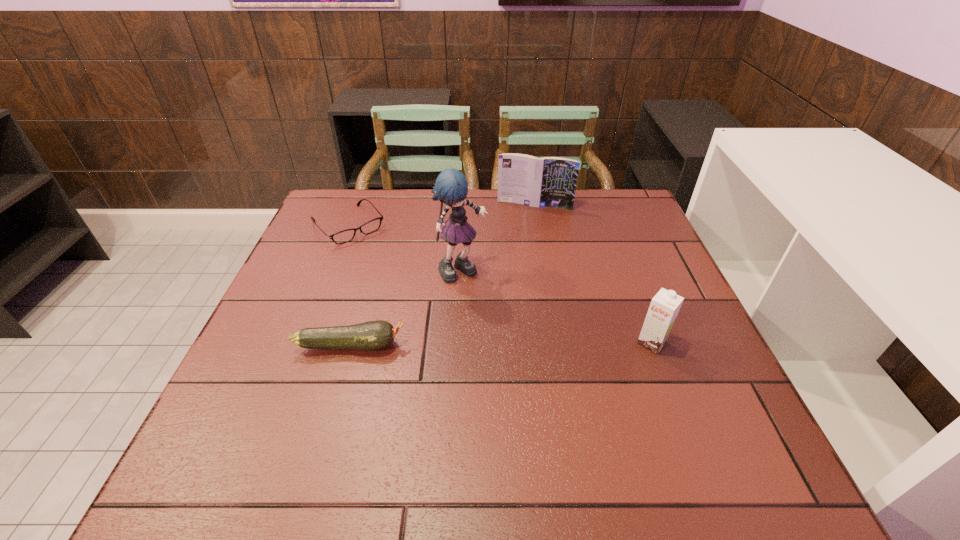
Find the location of a particular element. vacant space on the desktop that is between the zucchini and the chocolate milk and is positioned on the front-facing side of the shortest object is located at coordinates (458, 345).

The height and width of the screenshot is (540, 960). Identify the location of vacant spot on the desktop that is between the zucchini and the chocolate milk and is positioned on the front cover of the second object from right to left. (501, 344).

Locate an element on the screen. free space on the desktop that is between the fourth tallest object and the rightmost object and is positioned on the front-facing side of the tallest object is located at coordinates (546, 343).